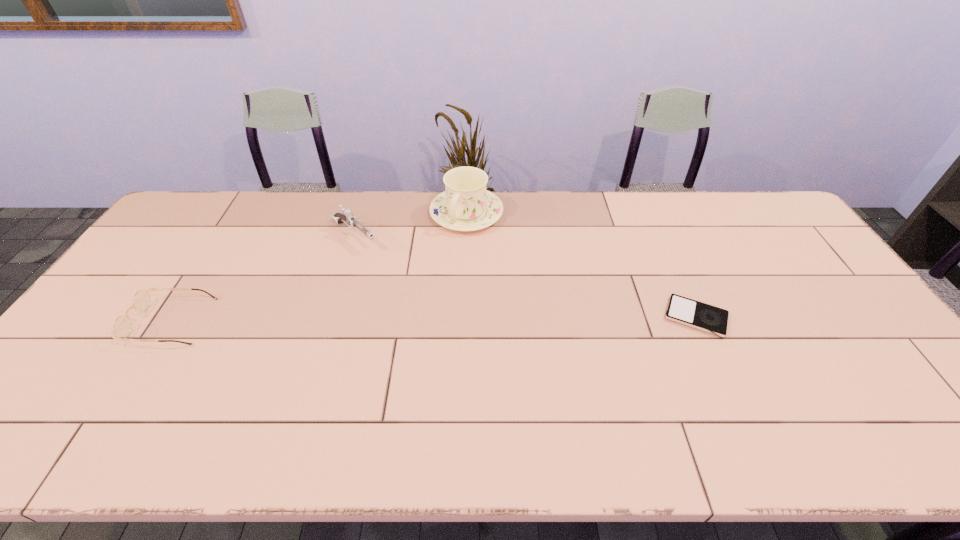
The image size is (960, 540). I want to click on vacant region at the right edge of the desktop, so click(x=772, y=237).

The height and width of the screenshot is (540, 960). I want to click on free area in between the third object from left to right and the third tallest object, so click(319, 267).

This screenshot has height=540, width=960. I want to click on vacant area that lies between the rightmost object and the tallest object, so click(x=581, y=265).

This screenshot has width=960, height=540. In order to click on vacant region between the spectacles and the shortest object in this screenshot , I will do `click(434, 319)`.

Find the location of `free spot between the rightmost object and the chinaware`. free spot between the rightmost object and the chinaware is located at coordinates (581, 265).

Find the location of a particular element. The image size is (960, 540). vacant space in between the gun and the chinaware is located at coordinates (411, 225).

Where is `unoccupied area between the leftmost object and the third object from left to right`? The image size is (960, 540). unoccupied area between the leftmost object and the third object from left to right is located at coordinates (319, 267).

The height and width of the screenshot is (540, 960). Identify the location of unoccupied position between the second object from left to right and the iPod. (525, 276).

Where is `free spot between the leftmost object and the iPod`? free spot between the leftmost object and the iPod is located at coordinates (434, 319).

At what (x,y) coordinates should I click in order to perform the action: click on empty space between the rightmost object and the chinaware. Please return your answer as a coordinate pair (x, y). The width and height of the screenshot is (960, 540). Looking at the image, I should click on (581, 265).